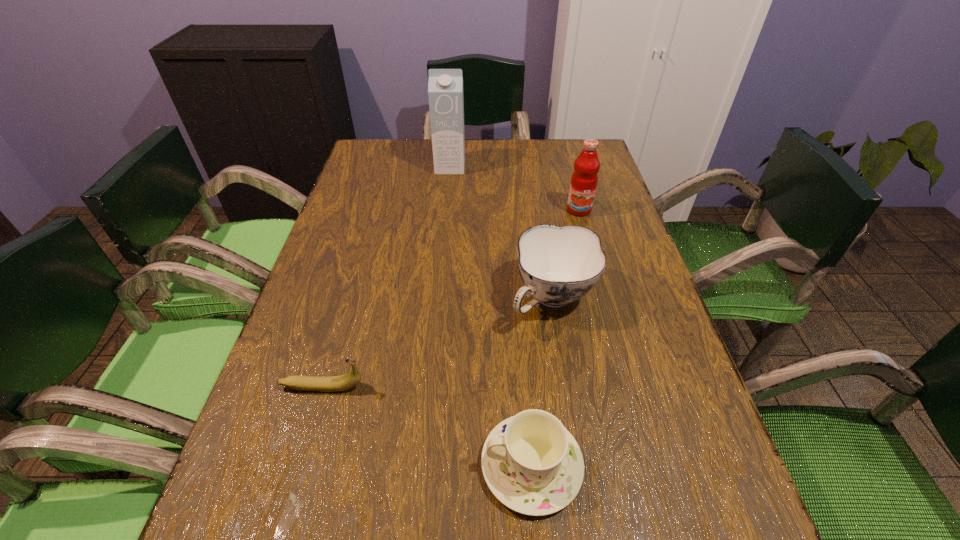
The width and height of the screenshot is (960, 540). I want to click on free spot located 0.310m on the front label of the fourth object from right to left, so click(x=444, y=239).

Identify the location of vacant space positioned 0.350m on the front label of the fruit juice. (608, 316).

Where is `free space located 0.230m on the front of the taller chinaware`? This screenshot has width=960, height=540. free space located 0.230m on the front of the taller chinaware is located at coordinates click(x=576, y=447).

Identify the location of vacant point located 0.290m at the stem of the banana. The height and width of the screenshot is (540, 960). (523, 387).

Find the location of `free region located 0.070m on the handle side of the nearest object`. free region located 0.070m on the handle side of the nearest object is located at coordinates (438, 465).

At what (x,y) coordinates should I click in order to perform the action: click on free region located on the handle side of the nearest object. Please return your answer as a coordinate pair (x, y). Looking at the image, I should click on (269, 465).

Find the location of `vacant space located on the handle side of the nearest object`. vacant space located on the handle side of the nearest object is located at coordinates (425, 465).

Where is `object located at the far edge`? This screenshot has width=960, height=540. object located at the far edge is located at coordinates (445, 86).

At what (x,y) coordinates should I click in order to perform the action: click on object positioned at the left edge. Please return your answer as a coordinate pair (x, y). Looking at the image, I should click on (347, 381).

Identify the location of fruit juice at the right edge. (584, 179).